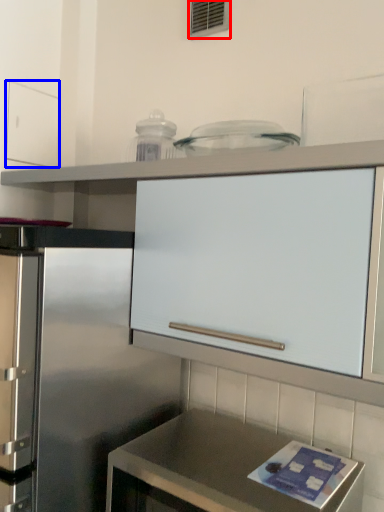
Question: Which object is closer to the camera taking this photo, window (highlighted by a red box) or drawer (highlighted by a blue box)?

Choices:
 (A) window
 (B) drawer

Answer: (A)